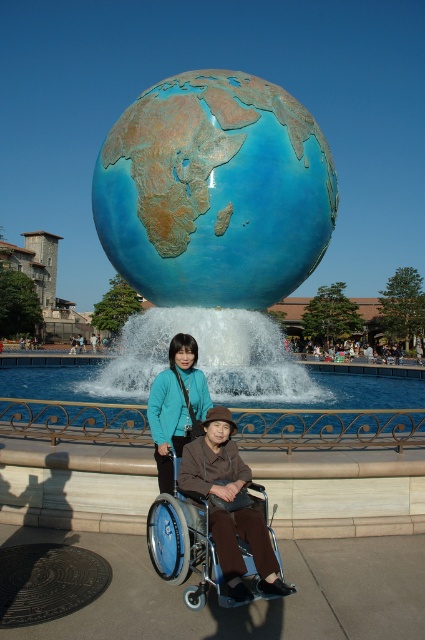
Does blue polished globe at center have a smaller size compared to blue metallic wheelchair at lower center?

No, blue polished globe at center is not smaller than blue metallic wheelchair at lower center.

Between point (184, 301) and point (206, 556), which one is positioned behind?

The point (184, 301) is more distant.

Which is in front, point (206, 161) or point (190, 557)?

Point (190, 557)

This screenshot has height=640, width=425. Find the location of `blue polished globe at center`. blue polished globe at center is located at coordinates (212, 225).

Looking at this image, can you confirm if blue metallic wheelchair at lower center is positioned to the left of matte teal jacket at center?

In fact, blue metallic wheelchair at lower center is to the right of matte teal jacket at center.

Is blue metallic wheelchair at lower center wider than matte teal jacket at center?

Indeed, blue metallic wheelchair at lower center has a greater width compared to matte teal jacket at center.

Which is in front, point (265, 506) or point (178, 438)?

Point (265, 506) is more forward.

The image size is (425, 640). Find the location of `blue metallic wheelchair at lower center`. blue metallic wheelchair at lower center is located at coordinates (186, 541).

Looking at this image, is blue polished globe at center to the right of matte teal jacket at center from the viewer's perspective?

Incorrect, blue polished globe at center is not on the right side of matte teal jacket at center.

Who is more forward, (201,86) or (176,376)?

Point (176,376) is more forward.

Locate an element on the screen. The width and height of the screenshot is (425, 640). blue polished globe at center is located at coordinates (212, 225).